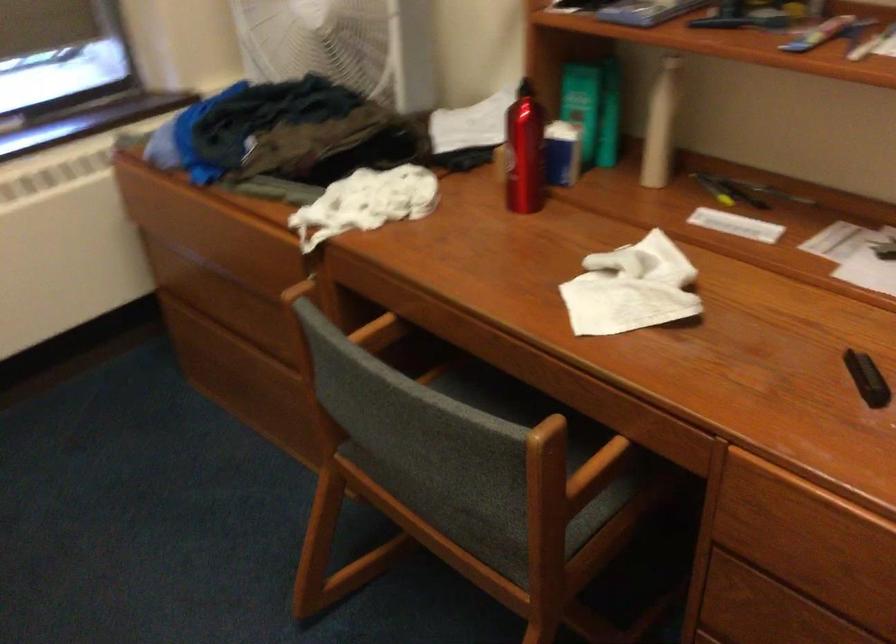
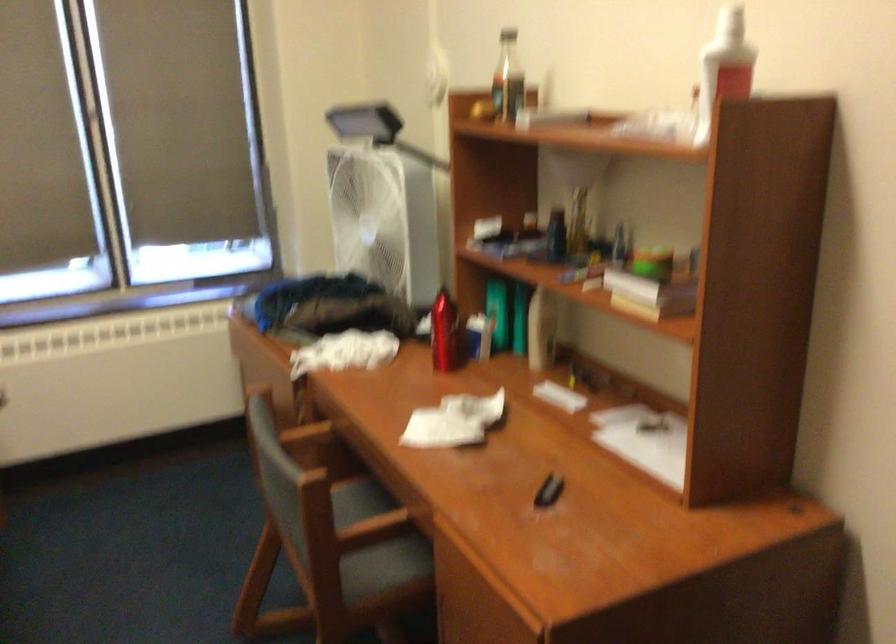
From the picture: The images are taken continuously from a first-person perspective. In which direction are you moving?

The cameraman walked toward right, backward.